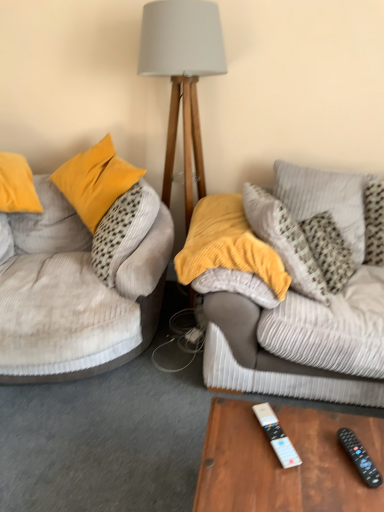
In order to click on free space in front of black plastic remote control at lower right, positioned as the 2th remote control in left-to-right order in this screenshot , I will do `click(355, 494)`.